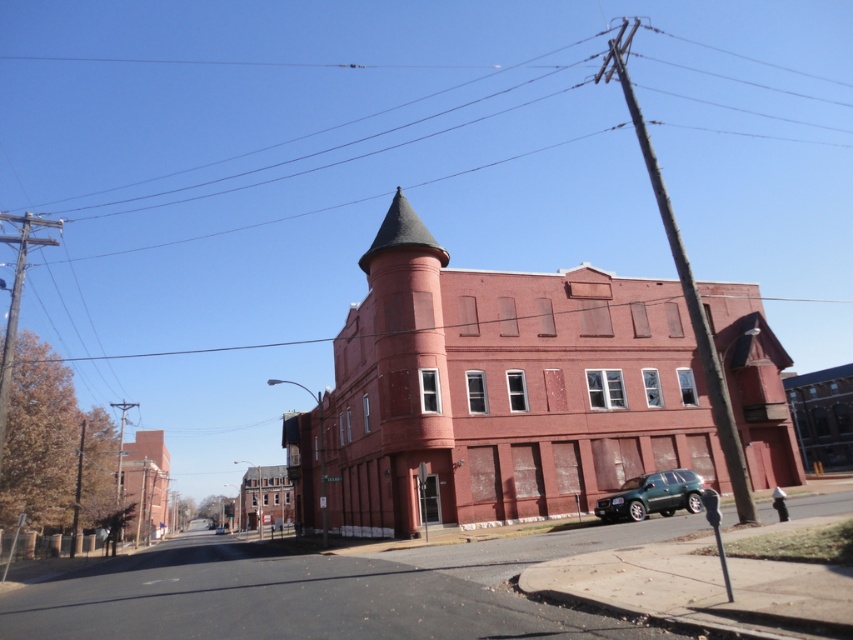
Which is above, green matte suv at lower right or green metallic suv at center?

green matte suv at lower right

Does green matte suv at lower right appear on the left side of green metallic suv at center?

Incorrect, green matte suv at lower right is not on the left side of green metallic suv at center.

Is point (645, 490) farther from viewer compared to point (225, 525)?

That is False.

Locate an element on the screen. green matte suv at lower right is located at coordinates (653, 496).